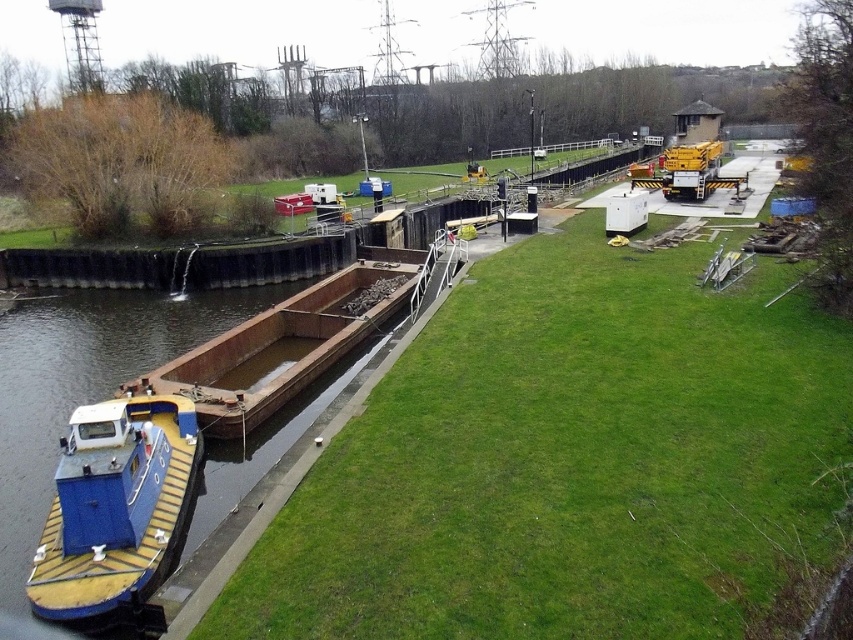
You are standing at the edge of the canal and want to place a small garden ornament exactly at the center of the green grass at center. According to the coordinates provided, what are the coordinates where you should place it?

The coordinates for the center of the green grass at center are exactly at point [572,461], so you should place the ornament there.

You are standing at the edge of the canal looking towards the grassy area. Which object is closer to you, the green grass at center or the blue painted wood boat at lower left?

The blue painted wood boat at lower left is closer to you since it is positioned to the left of the green grass at center, which is further away on the right side.

You are standing at the edge of the canal and want to walk towards the green grass at center. Which direction should you move relative to the blue painted wood boat at lower left?

Since the green grass at center is closer to the viewer than the blue painted wood boat at lower left, you should move towards the green grass at center, which is in the direction away from the blue painted wood boat at lower left.